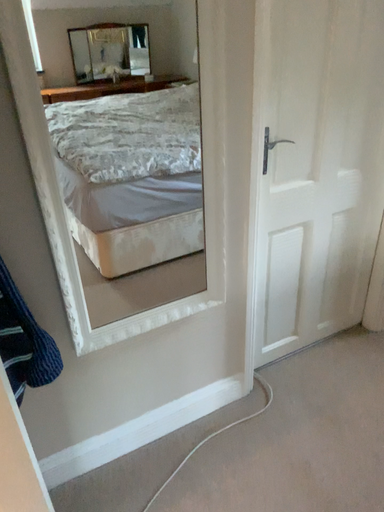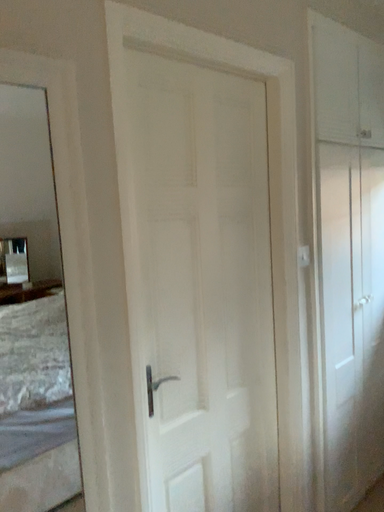
Question: Which way did the camera rotate in the video?

Choices:
 (A) rotated right
 (B) rotated left

Answer: (A)